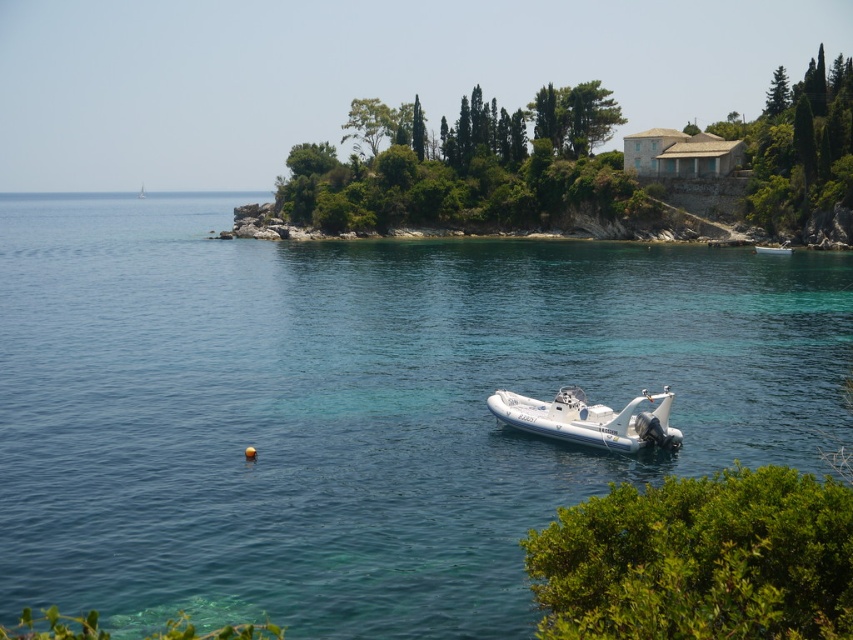
Question: Does clear blue water at center have a greater width compared to white rubber boat at center?

Choices:
 (A) no
 (B) yes

Answer: (B)

Question: From the image, what is the correct spatial relationship of clear blue water at center in relation to white rubber boat at center?

Choices:
 (A) right
 (B) left

Answer: (B)

Question: Which point is closer to the camera?

Choices:
 (A) (553, 417)
 (B) (653, 246)

Answer: (A)

Question: Does clear blue water at center have a greater width compared to white rubber boat at center?

Choices:
 (A) no
 (B) yes

Answer: (B)